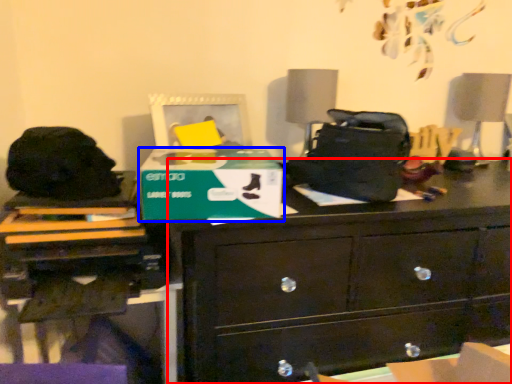
Question: Which object is closer to the camera taking this photo, chest of drawers (highlighted by a red box) or cardboard box (highlighted by a blue box)?

Choices:
 (A) chest of drawers
 (B) cardboard box

Answer: (B)